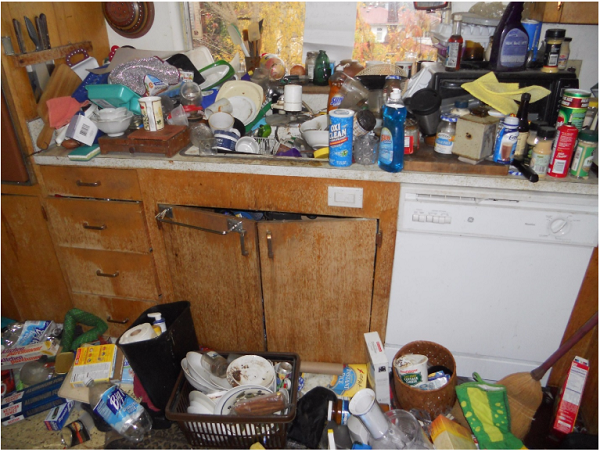
You are a GUI agent. You are given a task and a screenshot of the screen. Output one action in this format:
    pyautogui.click(x=<x>, y=<y>)
    Task: Click on the dishwasher
    
    Given the screenshot: What is the action you would take?
    pyautogui.click(x=521, y=310)